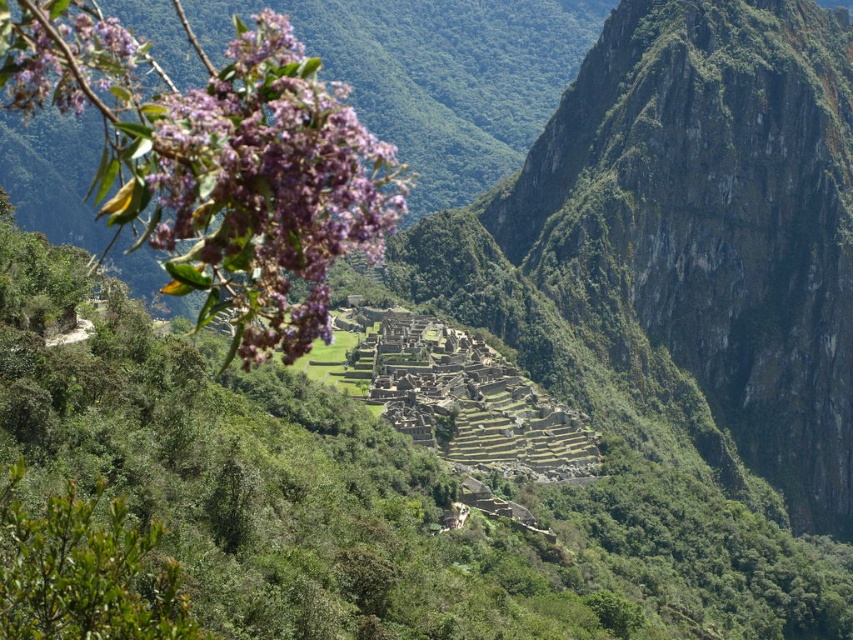
You are an archaeologist examining the purple matte flowers at upper left and the purple matte flower at upper left in the Machu Picchu scene. Which one is larger?

The purple matte flowers at upper left is larger than the purple matte flower at upper left.

You are a photographer standing at the entrance of Machu Picchu, aiming to capture the purple matte flowers at upper left and the purple matte flower at upper left in your shot. Which one is positioned closer to the camera?

The purple matte flowers at upper left are closer to the camera than the purple matte flower at upper left because the description states that the singular flower is behind the plural flowers.

You are a botanist studying the purple matte flowers at upper left and the purple matte flower at upper left in the Machu Picchu scene. Which of these two flowers is taller?

The purple matte flowers at upper left is taller than the purple matte flower at upper left.